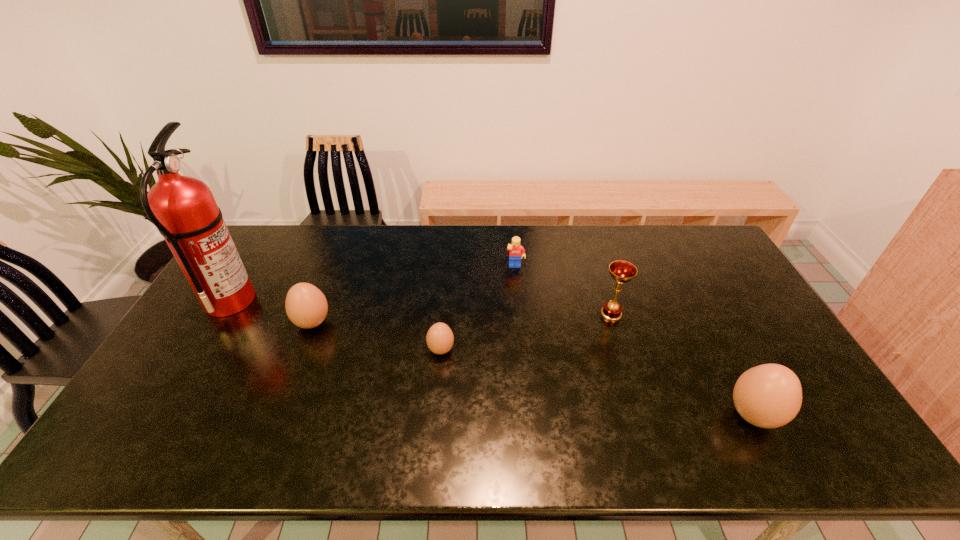
Locate an element on the screen. This screenshot has width=960, height=540. the farthest boiled egg is located at coordinates (306, 306).

Find the location of `the second object from left to right`. the second object from left to right is located at coordinates (306, 306).

Locate an element on the screen. This screenshot has width=960, height=540. the shortest object is located at coordinates (439, 338).

The image size is (960, 540). In order to click on the fifth farthest object in this screenshot , I will do `click(439, 338)`.

The width and height of the screenshot is (960, 540). In order to click on the rightmost boiled egg in this screenshot , I will do coord(769,396).

The height and width of the screenshot is (540, 960). Identify the location of the nearest object. (769, 396).

Locate an element on the screen. The width and height of the screenshot is (960, 540). Lego is located at coordinates (515, 249).

Identify the location of the third object from right to left. The width and height of the screenshot is (960, 540). point(515,249).

Find the location of a particular element. the fifth object from left to right is located at coordinates (621, 271).

Find the location of a particular element. The image size is (960, 540). the leftmost object is located at coordinates (183, 208).